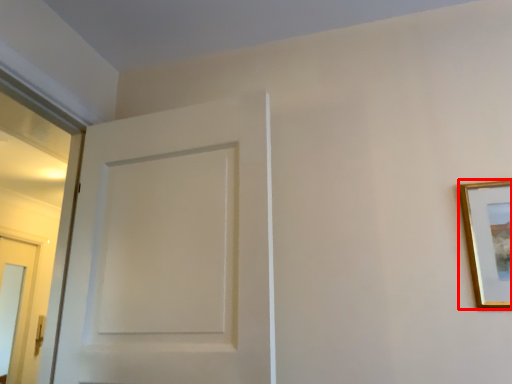
Question: Considering the relative positions of picture frame (annotated by the red box) and door in the image provided, where is picture frame (annotated by the red box) located with respect to the staircase?

Choices:
 (A) left
 (B) right

Answer: (B)